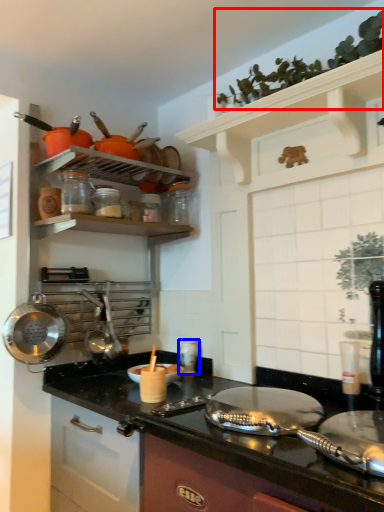
Question: Which object appears closest to the camera in this image, plant (highlighted by a red box) or appliance (highlighted by a blue box)?

Choices:
 (A) plant
 (B) appliance

Answer: (A)